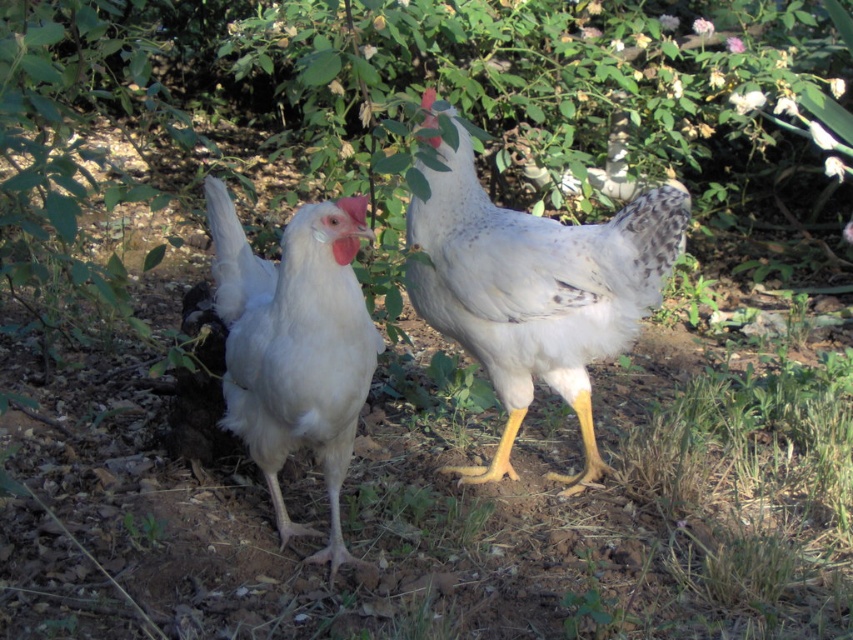
Question: Which point is closer to the camera taking this photo?

Choices:
 (A) (260, 429)
 (B) (408, 292)

Answer: (A)

Question: Can you confirm if white speckled feather at center is bigger than white feathered chicken at center?

Choices:
 (A) no
 (B) yes

Answer: (B)

Question: Which of the following is the farthest from the observer?

Choices:
 (A) (263, 428)
 (B) (469, 198)

Answer: (B)

Question: Where is white speckled feather at center located in relation to white feathered chicken at center in the image?

Choices:
 (A) above
 (B) below

Answer: (A)

Question: Is white speckled feather at center to the right of white feathered chicken at center from the viewer's perspective?

Choices:
 (A) no
 (B) yes

Answer: (B)